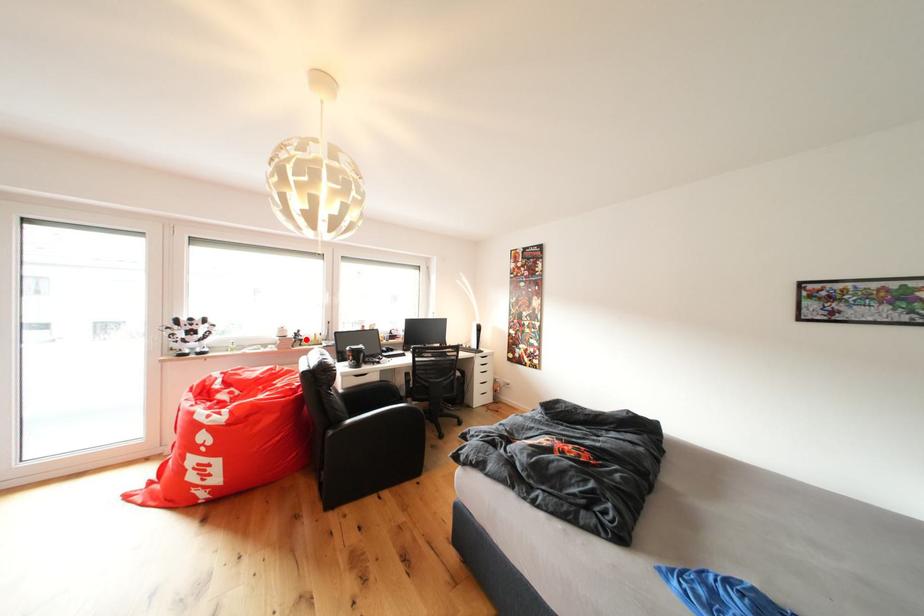
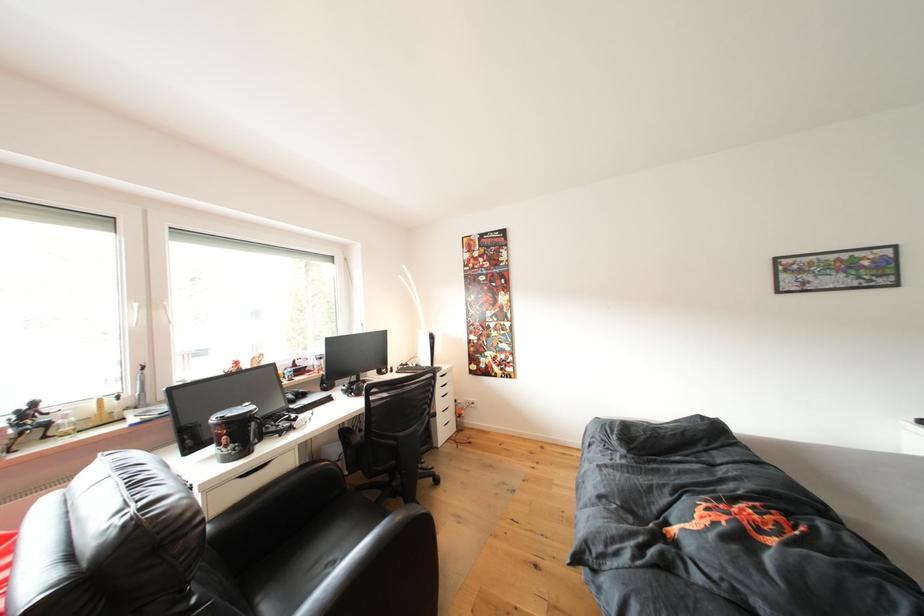
In the second image, find the point that corresponds to the highlighted location in the first image.

(35, 419)